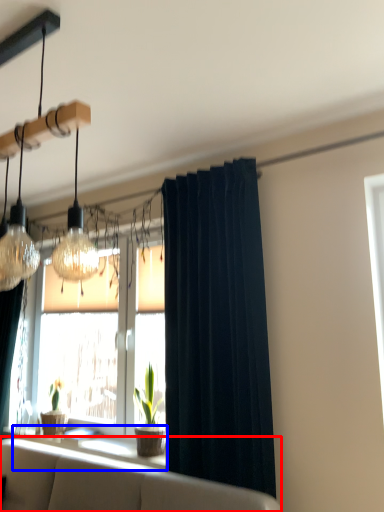
Question: Which point is closer to the camera, studio couch (highlighted by a red box) or window sill (highlighted by a blue box)?

Choices:
 (A) studio couch
 (B) window sill

Answer: (A)